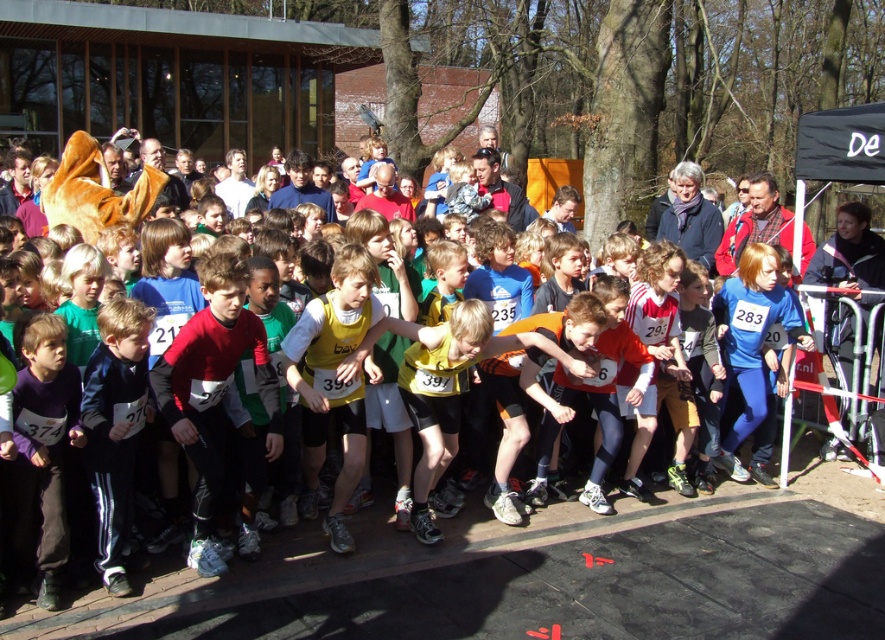
Is yellow fabric shirt at center bigger than dark blue tracksuit at center?

Yes, yellow fabric shirt at center is bigger than dark blue tracksuit at center.

Does point (318, 296) come in front of point (125, 458)?

That is False.

At what (x,y) coordinates should I click in order to perform the action: click on yellow fabric shirt at center. Please return your answer as a coordinate pair (x, y). This screenshot has height=640, width=885. Looking at the image, I should click on (335, 378).

Who is more forward, [63,358] or [109,349]?

Point [63,358] is in front.

Describe the element at coordinates (43, 445) in the screenshot. I see `purple matte shirt at center` at that location.

Between point (44, 540) and point (116, 465), which one is positioned in front?

Point (44, 540) is in front.

Locate an element on the screen. The height and width of the screenshot is (640, 885). purple matte shirt at center is located at coordinates (43, 445).

Which of these two, yellow fabric shirt at center or purple matte shirt at center, stands taller?

yellow fabric shirt at center is taller.

The width and height of the screenshot is (885, 640). I want to click on yellow fabric shirt at center, so click(x=335, y=378).